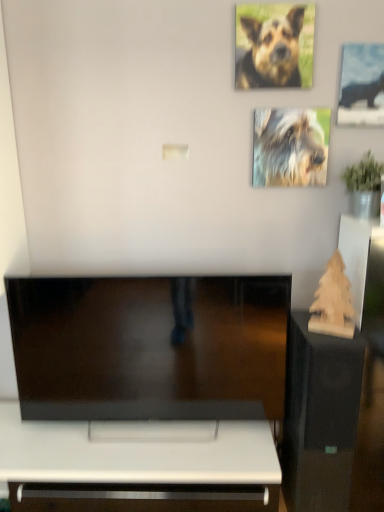
Question: Relative to metallic silver hippo at upper right, is brown fur dog at upper right, positioned as the first dog in front-to-back order, in front or behind?

Choices:
 (A) front
 (B) behind

Answer: (A)

Question: From the image's perspective, is brown fur dog at upper right, which is the 1th dog from top to bottom, above or below metallic silver hippo at upper right?

Choices:
 (A) below
 (B) above

Answer: (B)

Question: Which of these objects is positioned closest to the wooden sculpture at right?

Choices:
 (A) shaggy fur dog at upper right, which ranks as the second dog in top-to-bottom order
 (B) wooden christmas tree at right
 (C) metallic silver hippo at upper right
 (D) brown fur dog at upper right, the 2th dog in the back-to-front sequence

Answer: (B)

Question: Estimate the real-world distances between objects in this image. Which object is farther from the wooden christmas tree at right?

Choices:
 (A) wooden sculpture at right
 (B) shaggy fur dog at upper right, which is the second dog from front to back
 (C) brown fur dog at upper right, positioned as the first dog in front-to-back order
 (D) metallic silver hippo at upper right

Answer: (C)